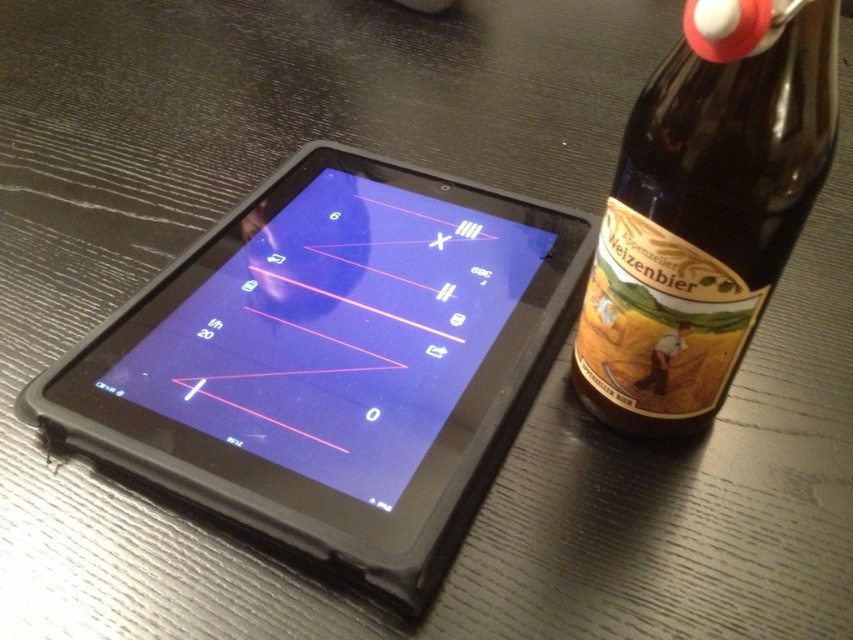
Is point (526, 264) positioned behind point (633, 122)?

Yes.

Between black rubberized tablet at center and brown glass bottle at right, which one has less height?

Standing shorter between the two is brown glass bottle at right.

Describe the element at coordinates (334, 360) in the screenshot. This screenshot has height=640, width=853. I see `black rubberized tablet at center` at that location.

Locate an element on the screen. Image resolution: width=853 pixels, height=640 pixels. black rubberized tablet at center is located at coordinates (334, 360).